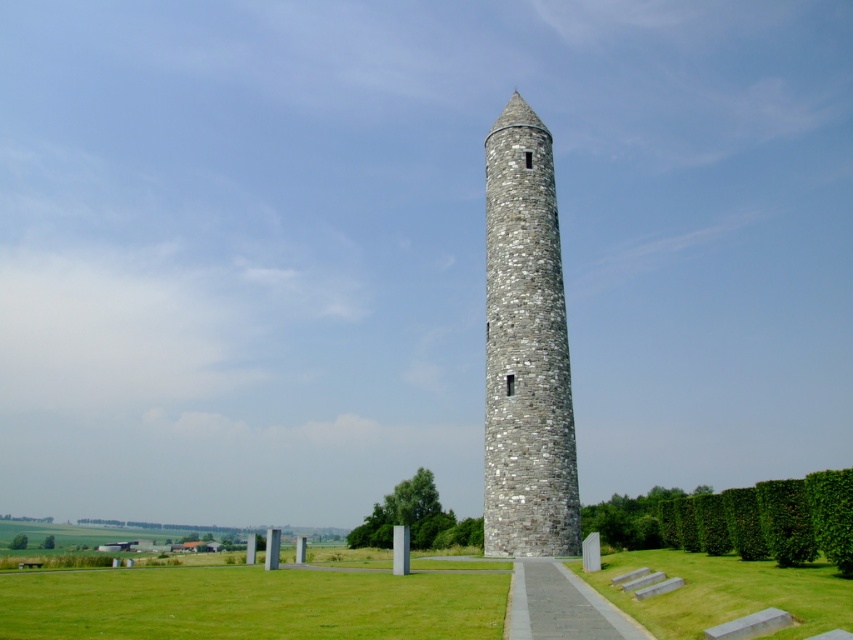
Does green grass at lower left have a lesser width compared to green grass at lower center?

Incorrect, green grass at lower left's width is not less than green grass at lower center's.

Between green grass at lower left and green grass at lower center, which one is positioned higher?

green grass at lower center is above.

What do you see at coordinates (248, 604) in the screenshot?
I see `green grass at lower left` at bounding box center [248, 604].

Find the location of `green grass at lower left`. green grass at lower left is located at coordinates (248, 604).

Is gray stone tower at center in front of green grass at lower center?

No, it is behind green grass at lower center.

Which is behind, point (489, 432) or point (613, 572)?

The point (489, 432) is more distant.

At what (x,y) coordinates should I click in order to perform the action: click on gray stone tower at center. Please return your answer as a coordinate pair (x, y). Looking at the image, I should click on (525, 348).

Can you confirm if green grass at lower left is taller than gray concrete path at center?

Correct, green grass at lower left is much taller as gray concrete path at center.

Which is more to the left, green grass at lower left or gray concrete path at center?

green grass at lower left is more to the left.

Who is more forward, [426,611] or [563,621]?

Point [563,621] is in front.

This screenshot has height=640, width=853. Find the location of `green grass at lower left`. green grass at lower left is located at coordinates (x=248, y=604).